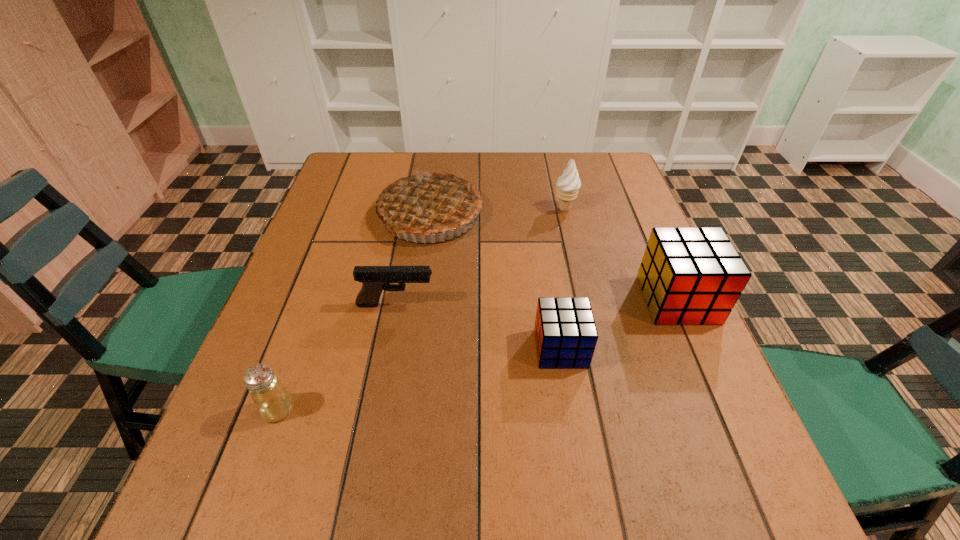
Identify the location of free spot located 0.150m on the left of the farther cube. (578, 300).

The width and height of the screenshot is (960, 540). What are the coordinates of `vacant area located 0.090m on the back of the pie` in the screenshot? It's located at (437, 170).

Identify the location of free region located on the front-facing side of the icecream. The image size is (960, 540). (471, 209).

Identify the location of vacant space located 0.390m on the front-facing side of the icecream. This screenshot has width=960, height=540. (414, 209).

This screenshot has width=960, height=540. What are the coordinates of `vacant space located 0.240m on the front-facing side of the icecream` in the screenshot? It's located at (468, 209).

Where is `vacant space located on the right of the nearest object`? vacant space located on the right of the nearest object is located at coordinates (344, 409).

I want to click on free space located 0.190m on the front-facing side of the pistol, so click(x=520, y=305).

Find the location of a particular element. object at the far edge is located at coordinates (431, 201).

Locate an element on the screen. The height and width of the screenshot is (540, 960). object that is at the near edge is located at coordinates (273, 402).

Locate an element on the screen. object that is at the left edge is located at coordinates (273, 402).